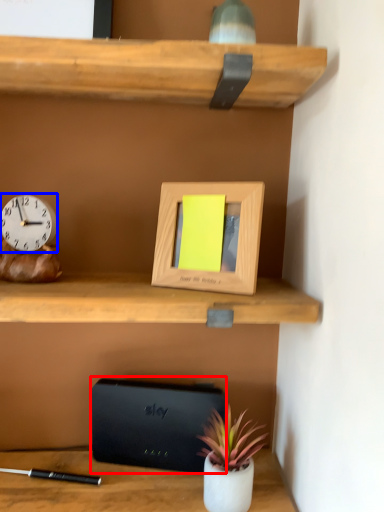
Question: Among these objects, which one is nearest to the camera, paperback book (highlighted by a red box) or clock (highlighted by a blue box)?

Choices:
 (A) paperback book
 (B) clock

Answer: (B)